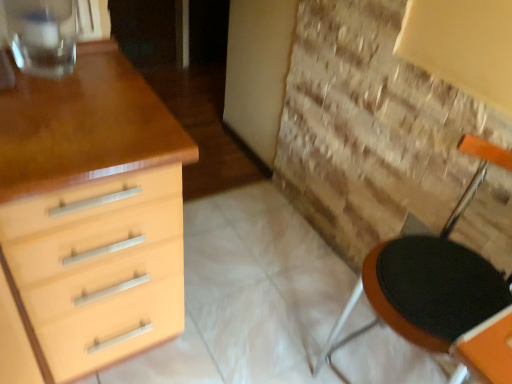
Where is `unoccupied region to the right of transparent glass at upper left`? unoccupied region to the right of transparent glass at upper left is located at coordinates (113, 93).